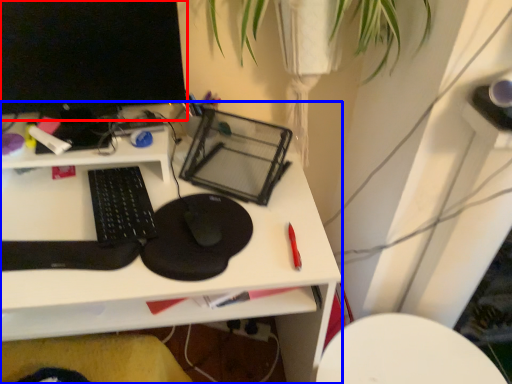
Question: Which object is closer to the camera taking this photo, computer monitor (highlighted by a red box) or desk (highlighted by a blue box)?

Choices:
 (A) computer monitor
 (B) desk

Answer: (B)